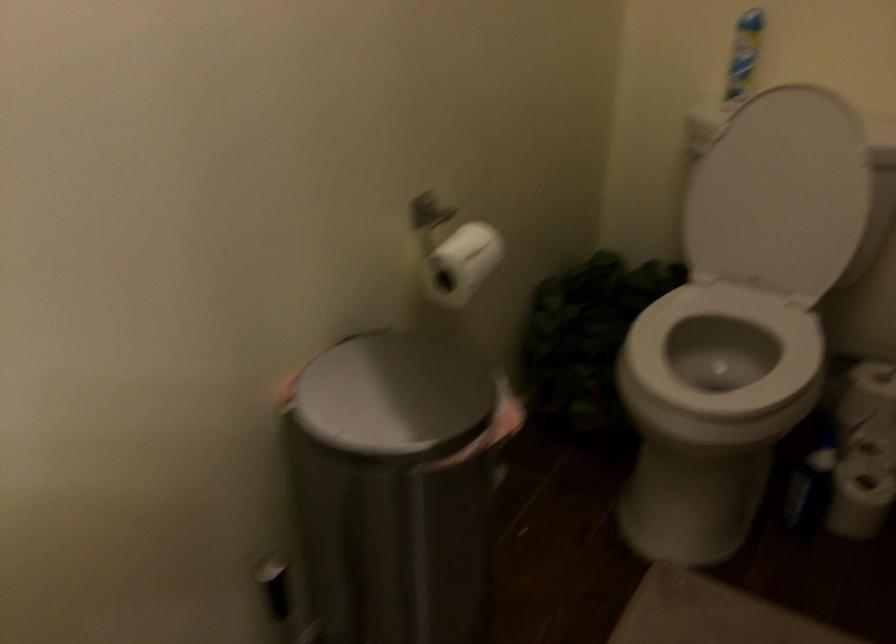
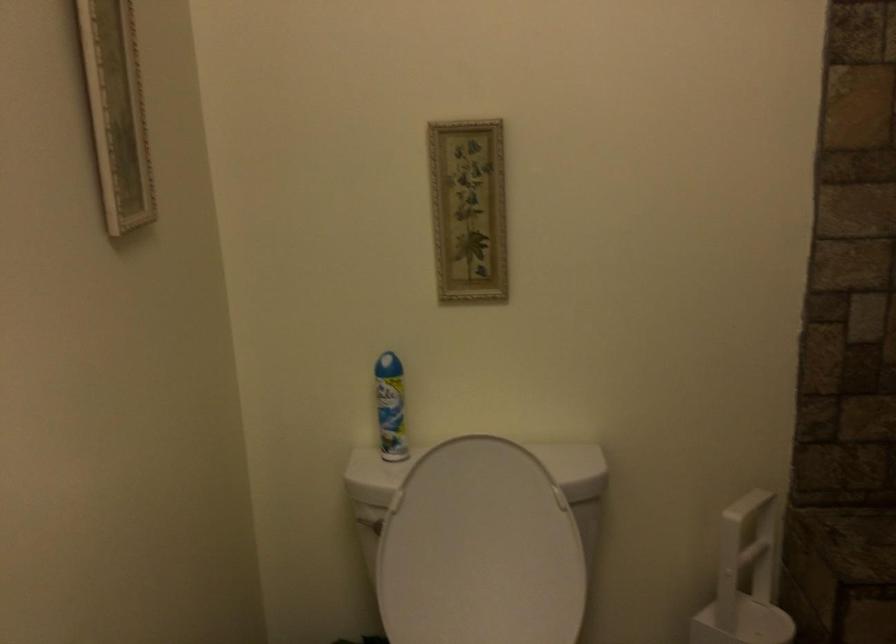
The point at (693,153) is marked in the first image. Where is the corresponding point in the second image?

(368, 522)